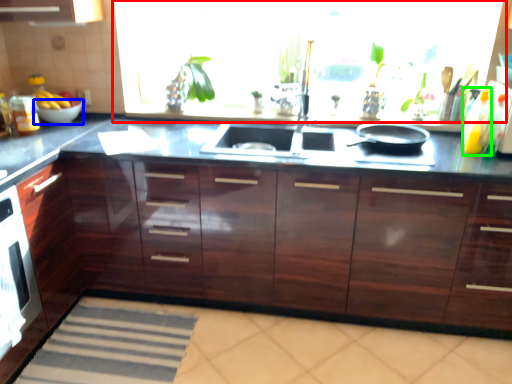
Question: Based on their relative distances, which object is farther from window screen (highlighted by a red box)? Choose from bowl (highlighted by a blue box) and bottle (highlighted by a green box).

Choices:
 (A) bowl
 (B) bottle

Answer: (A)